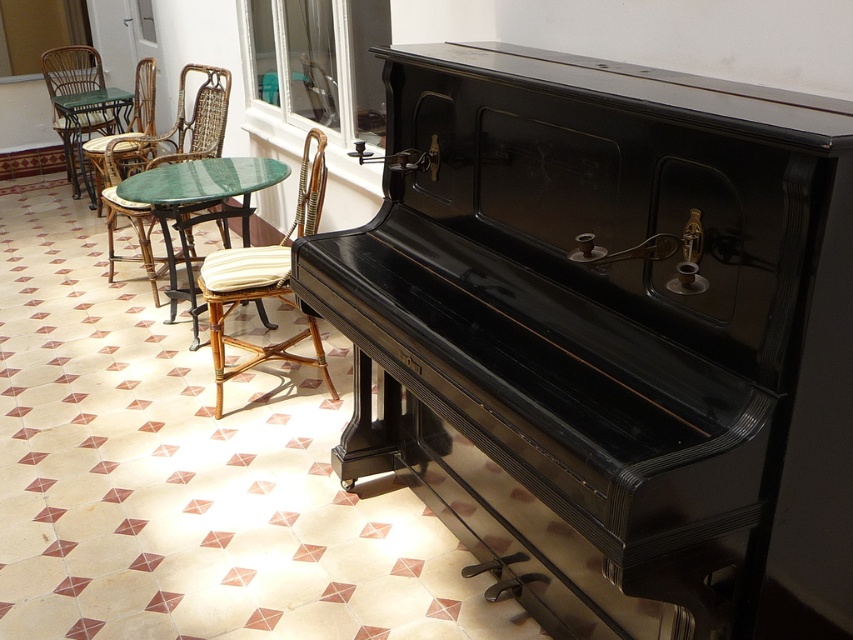
Question: Is woven rattan chair with striped cushion at center closer to camera compared to woven rattan chair at left?

Choices:
 (A) yes
 (B) no

Answer: (A)

Question: Which object appears farthest from the camera in this image?

Choices:
 (A) woven rattan chair at left
 (B) rattan wicker chair with cushion at left
 (C) wicker chair at left

Answer: (C)

Question: Is woven rattan chair with striped cushion at center wider than wicker chair at left?

Choices:
 (A) yes
 (B) no

Answer: (B)

Question: Which of these objects is positioned farthest from the glossy black piano at center?

Choices:
 (A) wicker chair at left
 (B) green marble table at center

Answer: (A)

Question: Which object is farther from the camera taking this photo?

Choices:
 (A) rattan wicker chair with cushion at left
 (B) green marble table at center

Answer: (A)

Question: Can you confirm if green marble table at center is bigger than rattan wicker chair with cushion at left?

Choices:
 (A) yes
 (B) no

Answer: (B)